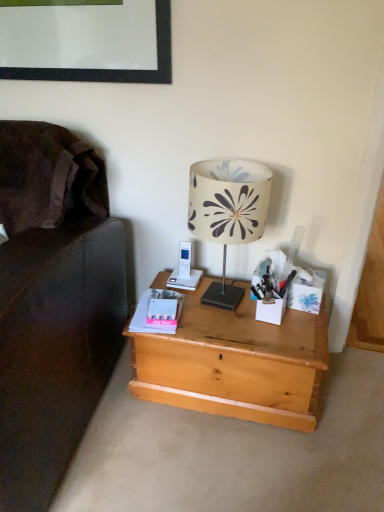
Where is `free spot to the right of matte pink paperback book at center-left`? This screenshot has width=384, height=512. free spot to the right of matte pink paperback book at center-left is located at coordinates (215, 321).